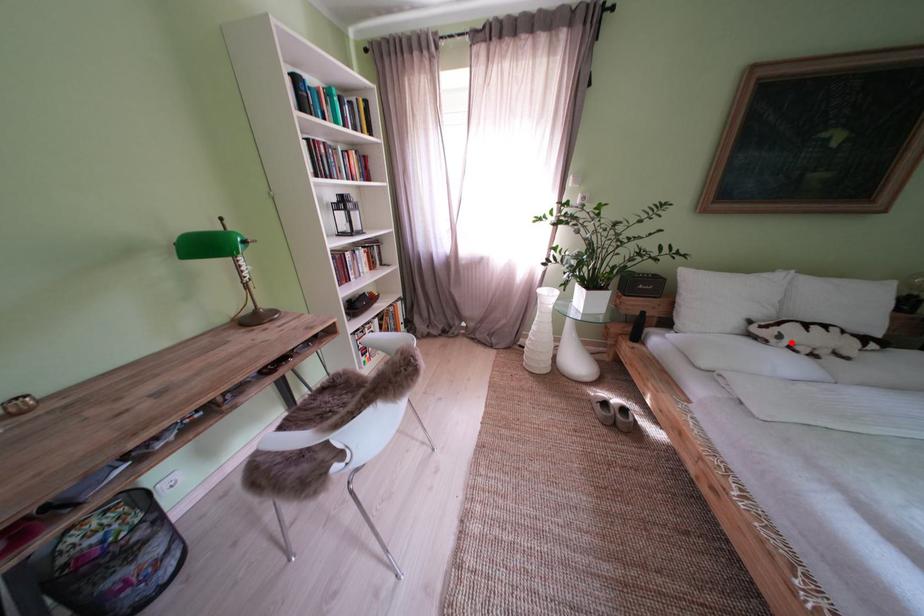
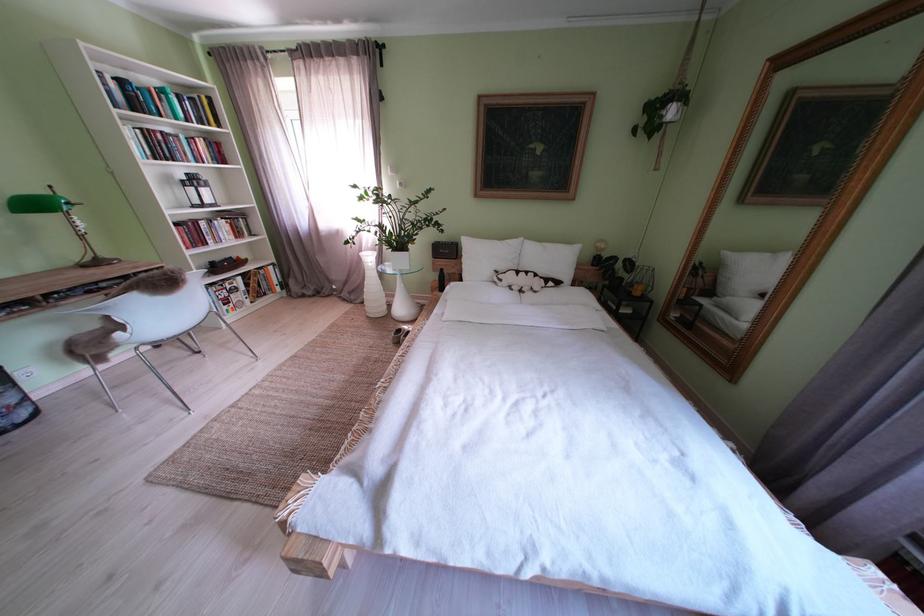
Find the pixel in the second image that matches the highlighted location in the first image.

(512, 285)